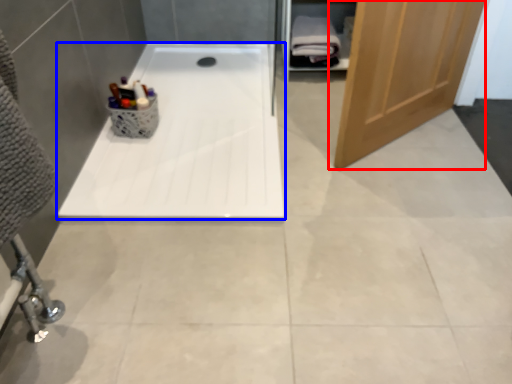
Question: Which point is further to the camera, door (highlighted by a red box) or bathtub (highlighted by a blue box)?

Choices:
 (A) door
 (B) bathtub

Answer: (B)